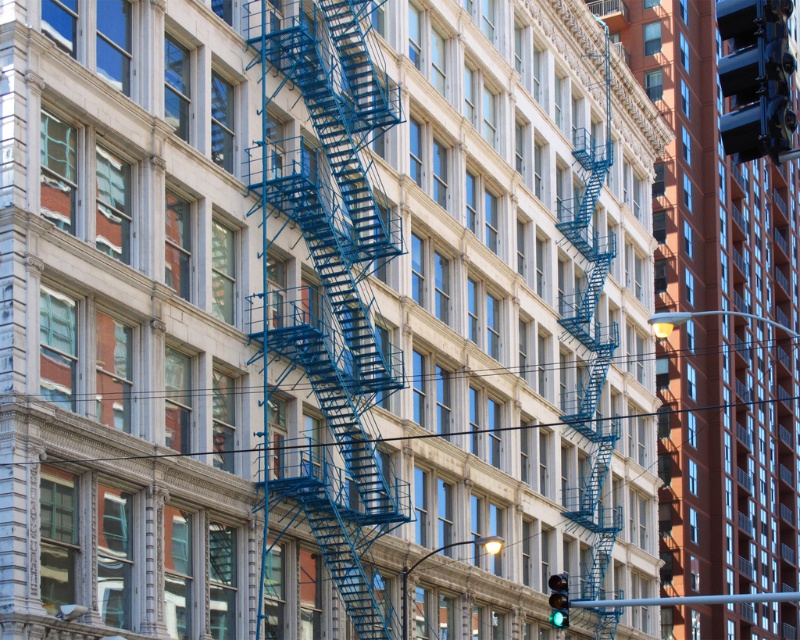
Question: Based on their relative distances, which object is farther from the metallic blue traffic light at upper right?

Choices:
 (A) metallic gray pole at center
 (B) blue metal fire escape at center

Answer: (A)

Question: Estimate the real-world distances between objects in this image. Which object is farther from the green glass traffic light at lower right?

Choices:
 (A) metallic gray pole at center
 (B) metallic silver pole at lower center
 (C) metallic blue traffic light at upper right

Answer: (C)

Question: Does metallic gray pole at center appear on the left side of green glass traffic light at lower right?

Choices:
 (A) no
 (B) yes

Answer: (B)

Question: Considering the real-world distances, which object is farthest from the blue metal fire escape at center?

Choices:
 (A) green glass traffic light at lower right
 (B) metallic blue traffic light at upper right
 (C) metallic gray pole at center
 (D) metallic silver pole at lower center

Answer: (B)

Question: Is blue metal fire escape at center below metallic gray pole at center?

Choices:
 (A) yes
 (B) no

Answer: (B)

Question: Can you confirm if metallic silver pole at lower center is positioned to the right of green glass traffic light at lower right?

Choices:
 (A) no
 (B) yes

Answer: (B)